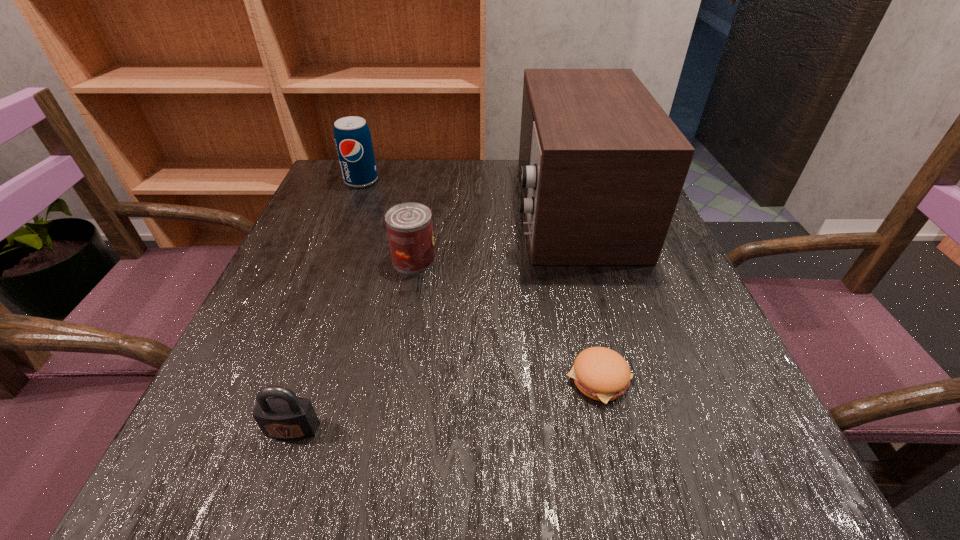
Identify the location of empty space between the radio receiver and the padlock. The image size is (960, 540). (432, 319).

Locate an element on the screen. The height and width of the screenshot is (540, 960). vacant area that lies between the second tallest object and the padlock is located at coordinates (327, 305).

Find the location of a particular element. The height and width of the screenshot is (540, 960). free space that is in between the padlock and the fourth shortest object is located at coordinates (327, 305).

This screenshot has height=540, width=960. In order to click on free space between the second tallest object and the shortest object in this screenshot , I will do click(x=480, y=280).

You are a GUI agent. You are given a task and a screenshot of the screen. Output one action in this format:
    pyautogui.click(x=<x>, y=<y>)
    Task: Click on the vacant space that's between the patty and the third object from right to left
    This screenshot has height=540, width=960.
    Given the screenshot: What is the action you would take?
    pyautogui.click(x=506, y=319)

Locate an element on the screen. vacant space in between the radio receiver and the padlock is located at coordinates (432, 319).

Locate an element on the screen. free space between the fourth shortest object and the tallest object is located at coordinates (467, 194).

Identify the location of the second closest object to the tallest object. 600,373.

This screenshot has height=540, width=960. In order to click on object that is the nearest to the tallest object in this screenshot , I will do `click(409, 226)`.

The height and width of the screenshot is (540, 960). Find the location of `vacant area in the image that satisfies the following two spatial constraints: 1. on the front-facing side of the tallest object; 2. on the front of the padlock near the keyhole`. vacant area in the image that satisfies the following two spatial constraints: 1. on the front-facing side of the tallest object; 2. on the front of the padlock near the keyhole is located at coordinates (633, 429).